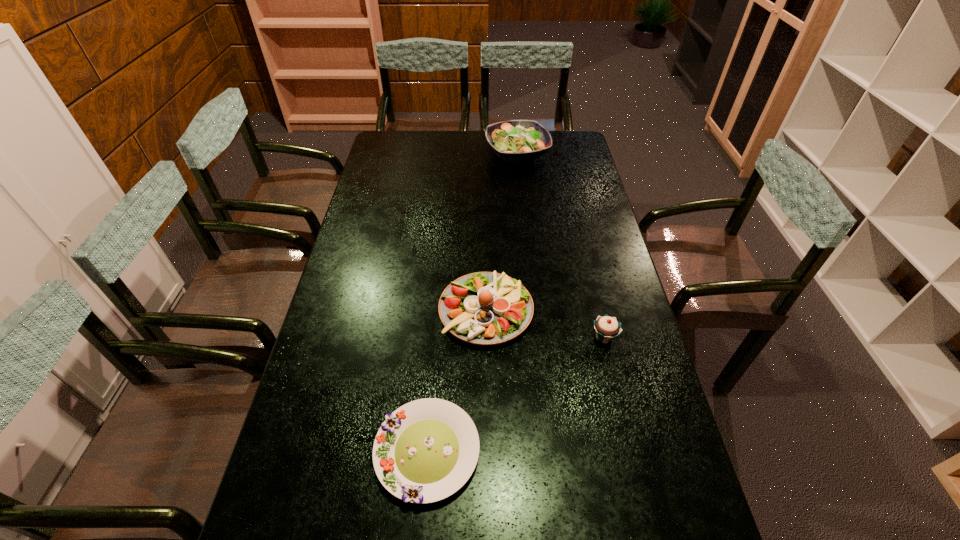
I want to click on vacant space that's between the nearest salad plate and the second tallest salad plate, so click(x=457, y=381).

The height and width of the screenshot is (540, 960). In order to click on unoccupied area between the farthest object and the second tallest salad plate in this screenshot , I will do 502,232.

Locate an element on the screen. Image resolution: width=960 pixels, height=540 pixels. free space between the shortest salad plate and the cupcake is located at coordinates (516, 394).

Where is `free space between the second farthest salad plate and the farthest object`? free space between the second farthest salad plate and the farthest object is located at coordinates (502, 232).

Where is `vacant area between the farthest salad plate and the second tallest salad plate`? The width and height of the screenshot is (960, 540). vacant area between the farthest salad plate and the second tallest salad plate is located at coordinates (502, 232).

Identify the location of free point between the rightmost object and the second tallest salad plate. (545, 324).

Identify the location of unoccupied position between the nearest object and the second tallest salad plate. (457, 381).

Identify the location of object that is the second closest to the second tallest salad plate. (426, 450).

Image resolution: width=960 pixels, height=540 pixels. In order to click on object that stands as the second closest to the second tallest salad plate in this screenshot , I will do `click(426, 450)`.

The height and width of the screenshot is (540, 960). I want to click on the second closest salad plate to the nearest salad plate, so click(515, 140).